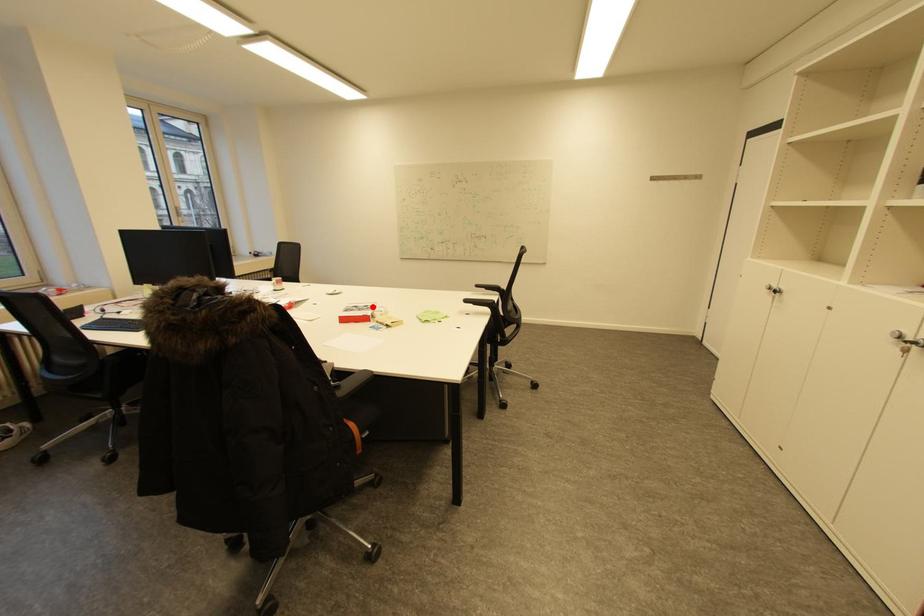
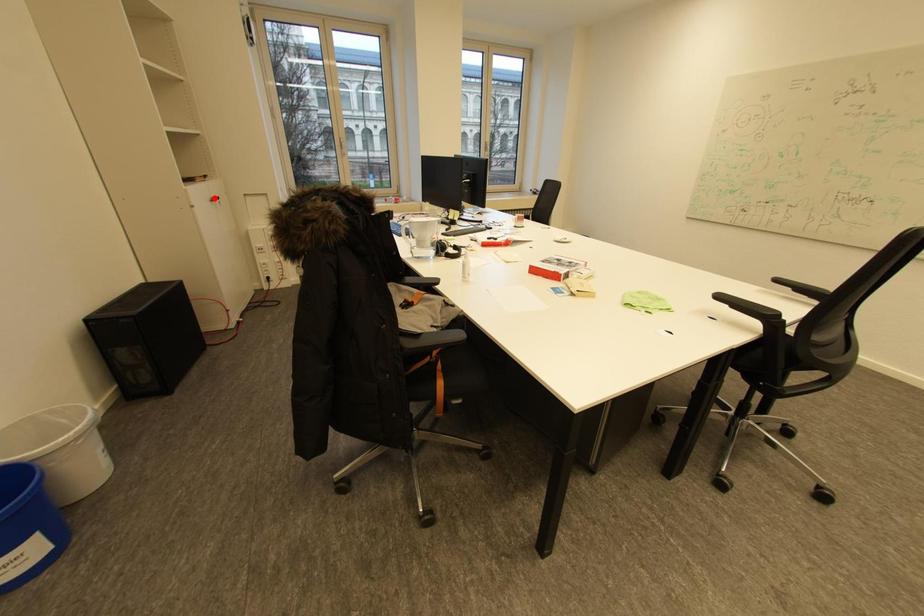
I am providing you with two images of the same scene from different viewpoints. A red point is marked on the first image and another point is marked on the second image. Is the red point in image1 aligned with the point shown in image2?

No